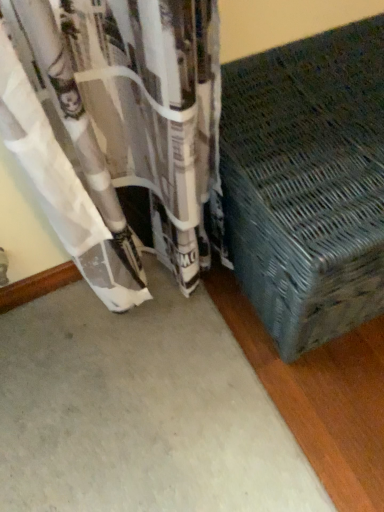
Image resolution: width=384 pixels, height=512 pixels. Describe the element at coordinates (307, 182) in the screenshot. I see `woven fabric ottoman at lower right` at that location.

Where is `woven fabric ottoman at lower right`? This screenshot has height=512, width=384. woven fabric ottoman at lower right is located at coordinates (307, 182).

Measure the distance between woven fabric ottoman at lower right and camera.

The distance of woven fabric ottoman at lower right from camera is 22.43 inches.

This screenshot has height=512, width=384. What are the coordinates of `woven fabric ottoman at lower right` in the screenshot? It's located at (307, 182).